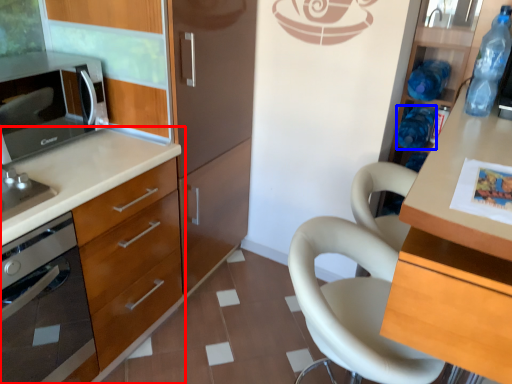
Question: Which object appears farthest to the camera in this image, cabinetry (highlighted by a red box) or bottle (highlighted by a blue box)?

Choices:
 (A) cabinetry
 (B) bottle

Answer: (B)